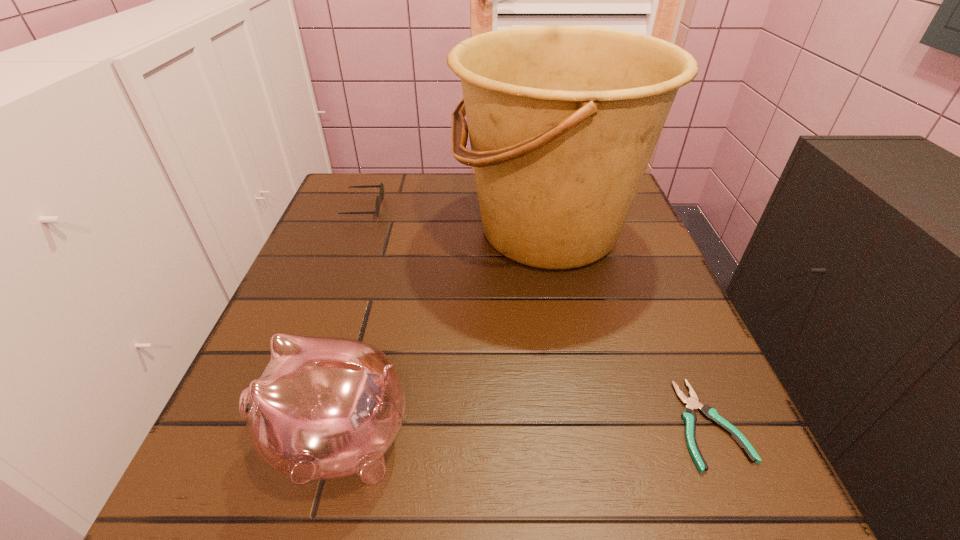
The width and height of the screenshot is (960, 540). I want to click on bucket that is at the far edge, so click(x=563, y=120).

At what (x,y) coordinates should I click in order to perform the action: click on sunglasses at the far edge. Please return your answer as a coordinate pair (x, y). The height and width of the screenshot is (540, 960). Looking at the image, I should click on 377,206.

Locate an element on the screen. The width and height of the screenshot is (960, 540). piggy bank that is at the near edge is located at coordinates (324, 408).

Identify the location of pliers situated at the near edge. This screenshot has width=960, height=540. (692, 403).

Locate an element on the screen. This screenshot has height=540, width=960. piggy bank present at the left edge is located at coordinates (324, 408).

Locate an element on the screen. sunglasses located at the left edge is located at coordinates (377, 206).

Where is `bucket located at the right edge`? This screenshot has width=960, height=540. bucket located at the right edge is located at coordinates (563, 120).

Locate an element on the screen. The height and width of the screenshot is (540, 960). pliers present at the right edge is located at coordinates (692, 403).

Locate an element on the screen. object that is positioned at the far left corner is located at coordinates (377, 206).

You are a GUI agent. You are given a task and a screenshot of the screen. Output one action in this format:
    pyautogui.click(x=<x>, y=<y>)
    Task: Click on the object that is at the near left corner
    This screenshot has width=960, height=540.
    Given the screenshot: What is the action you would take?
    pyautogui.click(x=324, y=408)